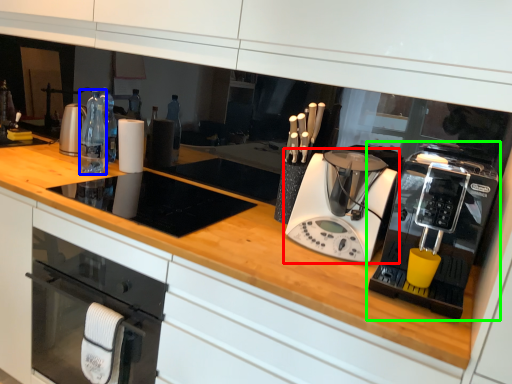
Question: Based on their relative distances, which object is nearer to home appliance (highlighted by a red box)? Choose from bottle (highlighted by a blue box) and home appliance (highlighted by a green box).

Choices:
 (A) bottle
 (B) home appliance

Answer: (B)